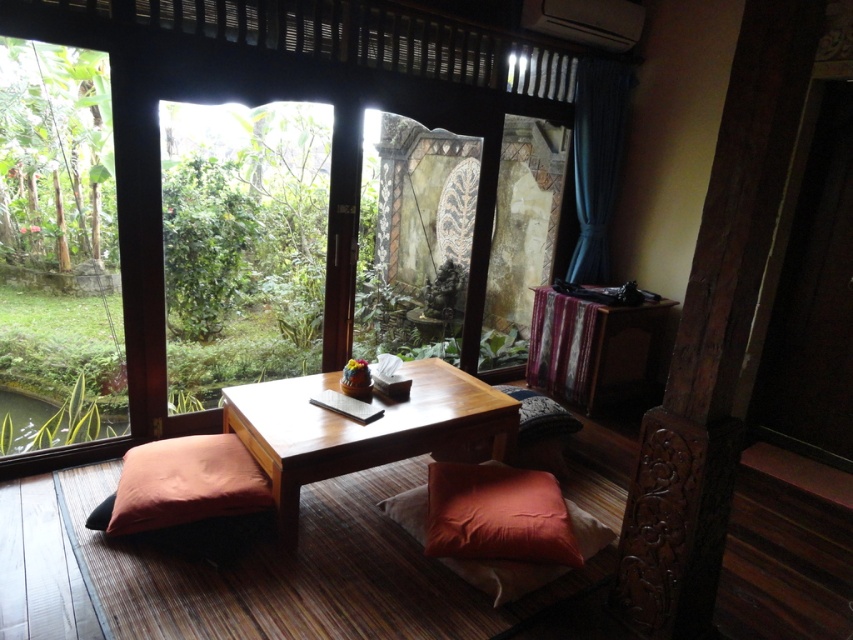
Question: Is wooden table at center positioned at the back of velvet orange cushion at lower center?

Choices:
 (A) no
 (B) yes

Answer: (B)

Question: Which of the following is the farthest from the observer?

Choices:
 (A) green leafy pond at lower left
 (B) dark blue fabric curtain at upper right

Answer: (B)

Question: Which point appears farthest from the camera in this image?

Choices:
 (A) (28, 432)
 (B) (257, 488)

Answer: (A)

Question: Can you confirm if orange fabric pillow at lower left is wider than dark blue fabric curtain at upper right?

Choices:
 (A) no
 (B) yes

Answer: (B)

Question: Which of these objects is positioned farthest from the velvet orange cushion at lower center?

Choices:
 (A) green leafy pond at lower left
 (B) wooden table at center
 (C) orange fabric pillow at lower left

Answer: (A)

Question: Can you confirm if dark blue fabric curtain at upper right is positioned to the right of wooden pad at center?

Choices:
 (A) yes
 (B) no

Answer: (A)